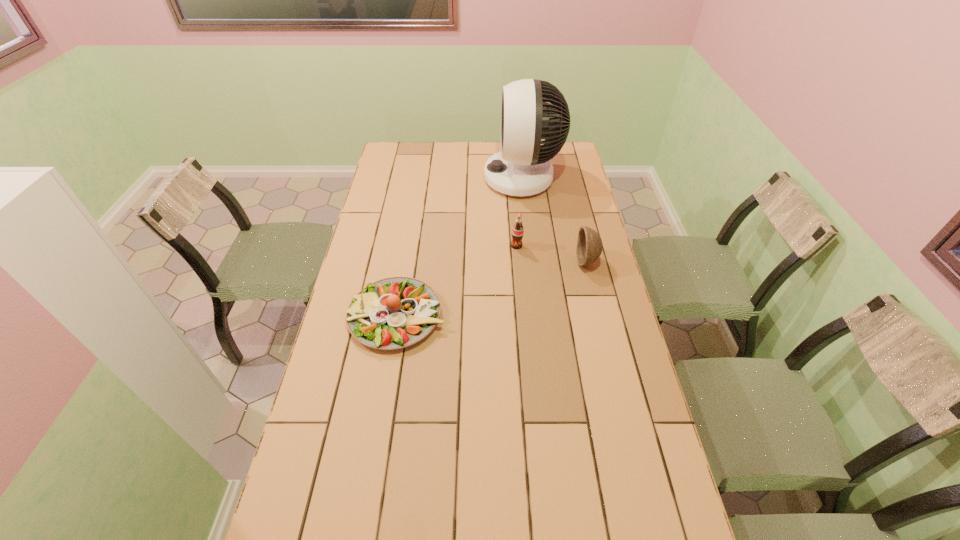
This screenshot has height=540, width=960. I want to click on fan, so click(x=522, y=168).

This screenshot has width=960, height=540. What are the coordinates of `the tallest object` in the screenshot? It's located at (522, 168).

The width and height of the screenshot is (960, 540). What are the coordinates of `soda` in the screenshot? It's located at coord(517,231).

Identify the location of bowl. The width and height of the screenshot is (960, 540). (589, 244).

What are the coordinates of `salad plate` in the screenshot? It's located at (393, 313).

I want to click on the shortest object, so click(x=393, y=313).

At what (x,y) coordinates should I click in order to perform the action: click on free space located 0.070m on the grille of the tallest object. Please return your answer as a coordinate pair (x, y). This screenshot has height=540, width=960. Looking at the image, I should click on (468, 178).

What are the coordinates of `vacant region located 0.250m on the grille of the tallest object` in the screenshot? It's located at (428, 178).

The width and height of the screenshot is (960, 540). I want to click on blank area located 0.160m on the grille of the tallest object, so click(x=448, y=178).

The height and width of the screenshot is (540, 960). I want to click on vacant point located 0.200m on the left of the soda, so click(458, 246).